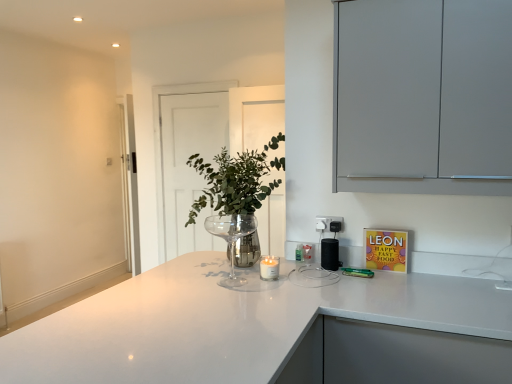
Question: Does white glossy countertop at center have a larger size compared to black plastic speaker at center?

Choices:
 (A) yes
 (B) no

Answer: (A)

Question: From a real-world perspective, is white glossy countertop at center physically above black plastic speaker at center?

Choices:
 (A) yes
 (B) no

Answer: (B)

Question: Is white glossy countertop at center thinner than black plastic speaker at center?

Choices:
 (A) no
 (B) yes

Answer: (A)

Question: Can you confirm if white glossy countertop at center is positioned to the left of black plastic speaker at center?

Choices:
 (A) no
 (B) yes

Answer: (B)

Question: Are white glossy countertop at center and black plastic speaker at center beside each other?

Choices:
 (A) yes
 (B) no

Answer: (B)

Question: Are white glossy countertop at center and black plastic speaker at center far apart?

Choices:
 (A) no
 (B) yes

Answer: (A)

Question: Is transparent glass door at center oriented away from matte gray cabinet at upper right?

Choices:
 (A) no
 (B) yes

Answer: (A)

Question: From the image's perspective, is transparent glass door at center located above matte gray cabinet at upper right?

Choices:
 (A) yes
 (B) no

Answer: (B)

Question: From the image's perspective, would you say transparent glass door at center is shown under matte gray cabinet at upper right?

Choices:
 (A) no
 (B) yes

Answer: (B)

Question: Is transparent glass door at center outside of matte gray cabinet at upper right?

Choices:
 (A) yes
 (B) no

Answer: (A)

Question: From a real-world perspective, is transparent glass door at center on matte gray cabinet at upper right?

Choices:
 (A) no
 (B) yes

Answer: (A)

Question: Can matte gray cabinet at upper right be found inside transparent glass door at center?

Choices:
 (A) no
 (B) yes

Answer: (A)

Question: From the image's perspective, is clear glass wine glass at center located above black plastic speaker at center?

Choices:
 (A) no
 (B) yes

Answer: (B)